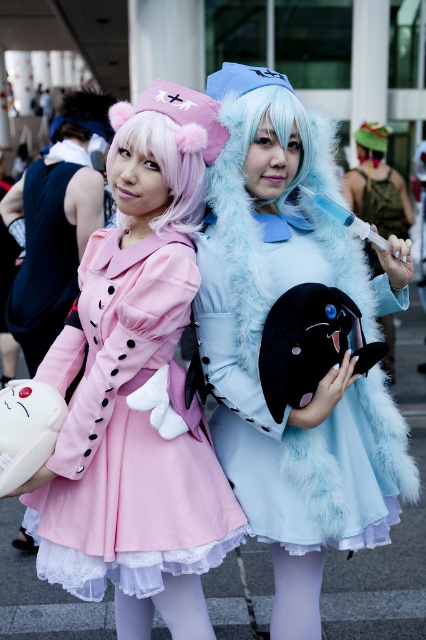
You are a photographer at a cosplay event and need to frame a shot that includes both the fuzzy blue dress at center and the pink fluffy wig at center. The camera has a maximum focus range of 50 centimeters. Will both items be in focus if they are positioned exactly as shown?

The fuzzy blue dress at center is 49.87 centimeters from the pink fluffy wig at center. Since the distance between them is less than the camera maximum focus range of 50 centimeters, both items will be in focus.

You are a photographer standing in front of the matte pink coat at center. You want to take a photo of it without any obstructions. Considering the distance, can you step back to avoid including the person standing in front of the coat?

The matte pink coat at center is 9.08 feet from viewer. Since the coat is already 9.08 feet away, stepping back might increase the distance, but the question is about avoiding a person in front. The description doesn not mention any obstruction by a person, so the answer should focus on the given data. However, since the coat is at center and the person is on the right, maybe the description missed something. Wait, the scene description mentions two people. The person on the left has a coat, and the right?